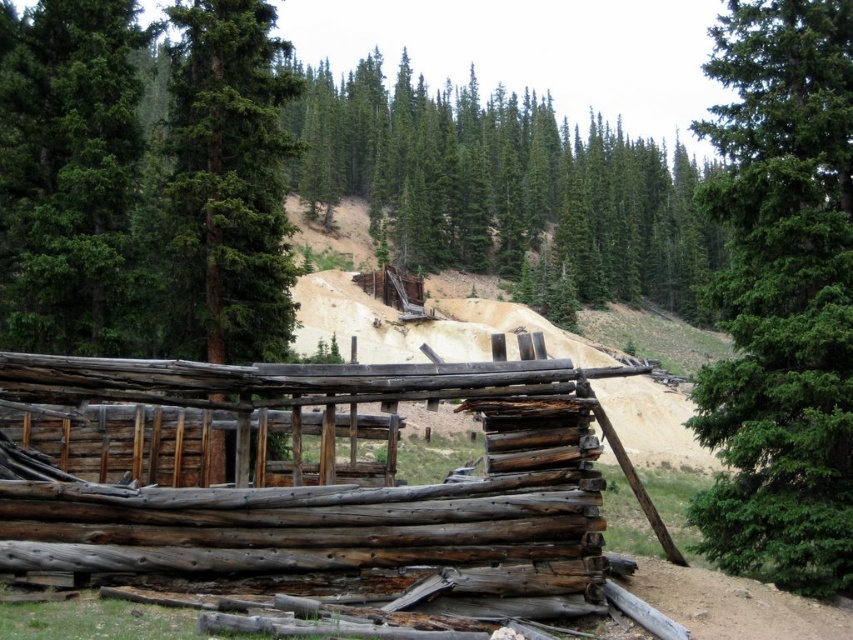
You are standing in front of the log cabin and want to walk to the brown dirt track at lower right. Which direction should you move relative to the green coniferous trees at upper center?

You should move away from the green coniferous trees at upper center towards the brown dirt track at lower right since the trees are closer to you than the dirt track.